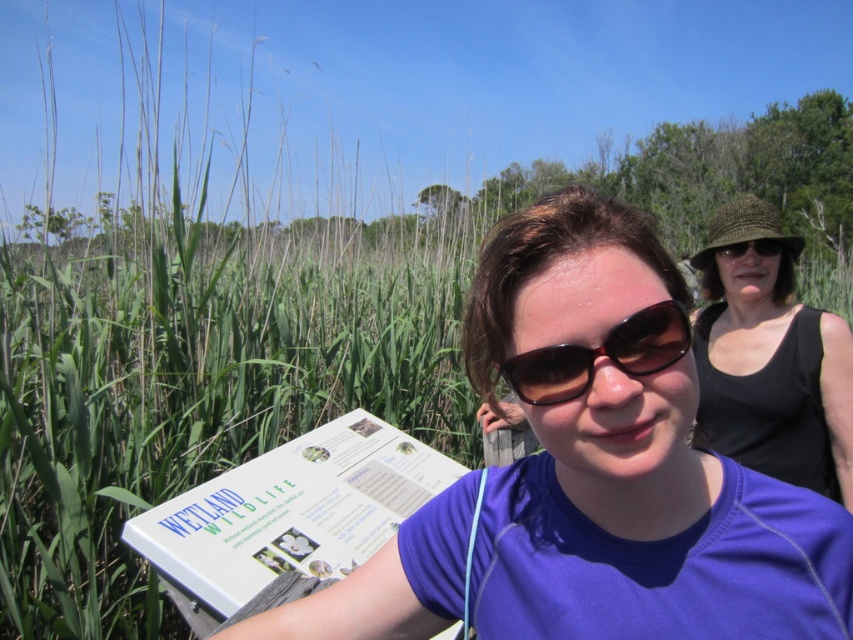
In the scene shown: Between purple fabric shirt at center and matte brown sunglasses at upper right, which one is positioned lower?

purple fabric shirt at center is below.

Who is more distant from viewer, (x=598, y=611) or (x=735, y=250)?

The point (x=735, y=250) is behind.

Image resolution: width=853 pixels, height=640 pixels. Find the location of `purple fabric shirt at center`. purple fabric shirt at center is located at coordinates (592, 474).

Can you confirm if green grass at center is positioned to the right of purple fabric shirt at center?

No, green grass at center is not to the right of purple fabric shirt at center.

Is green grass at center above purple fabric shirt at center?

Indeed, green grass at center is positioned over purple fabric shirt at center.

Is point (231, 330) in front of point (833, 560)?

No, (231, 330) is behind (833, 560).

Find the location of `green grass at center`. green grass at center is located at coordinates 195,365.

Who is lower down, black knitted hat at upper right or sunglasses at center?

black knitted hat at upper right

How distant is black knitted hat at upper right from sunglasses at center?

black knitted hat at upper right and sunglasses at center are 28.18 inches apart.

The image size is (853, 640). What do you see at coordinates (770, 362) in the screenshot?
I see `black knitted hat at upper right` at bounding box center [770, 362].

Where is `black knitted hat at upper right`? This screenshot has height=640, width=853. black knitted hat at upper right is located at coordinates (770, 362).